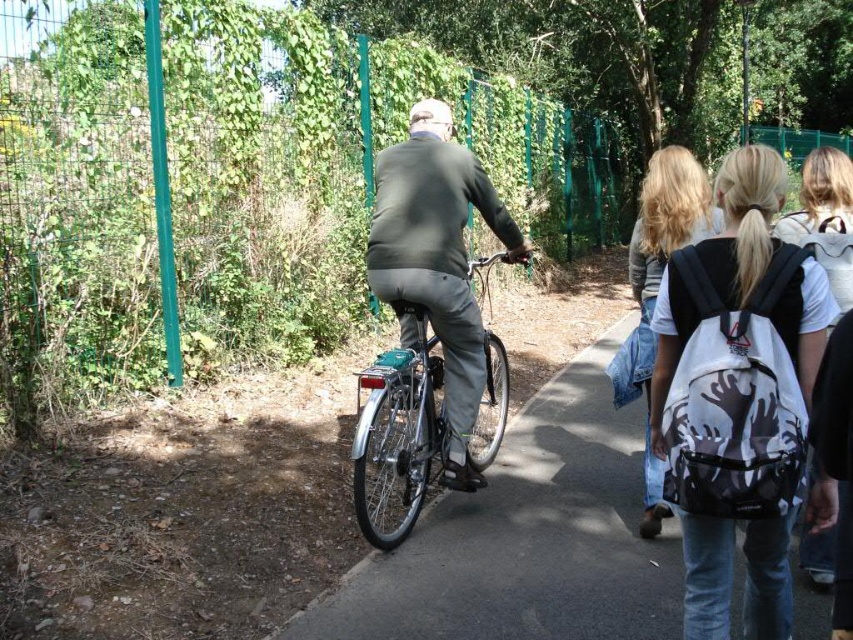
Question: Among these objects, which one is farthest from the camera?

Choices:
 (A) green wire mesh fence at upper left
 (B) white matte backpack at center right

Answer: (A)

Question: Which point appears farthest from the camera in this image?

Choices:
 (A) (262, 113)
 (B) (440, 132)
 (C) (782, 372)

Answer: (A)

Question: Considering the relative positions of white matte backpack at center right and dark gray sweater at center in the image provided, where is white matte backpack at center right located with respect to dark gray sweater at center?

Choices:
 (A) right
 (B) left

Answer: (A)

Question: Can you confirm if green wire mesh fence at upper left is positioned below white matte backpack at center right?

Choices:
 (A) no
 (B) yes

Answer: (A)

Question: Which point is farther to the camera?

Choices:
 (A) (184, 65)
 (B) (682, 275)
 (C) (374, 166)

Answer: (C)

Question: Is green wire mesh fence at upper left smaller than dark gray sweater at center?

Choices:
 (A) no
 (B) yes

Answer: (A)